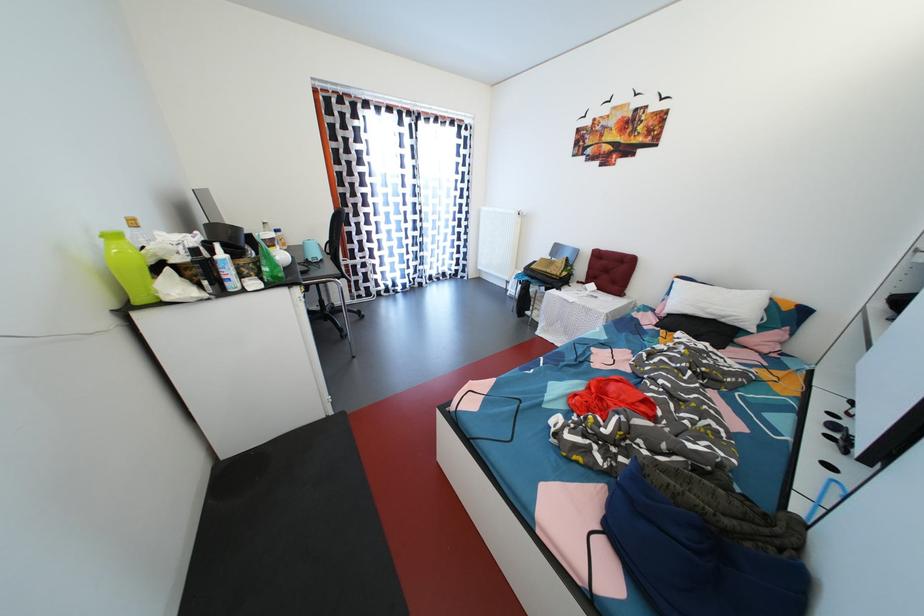
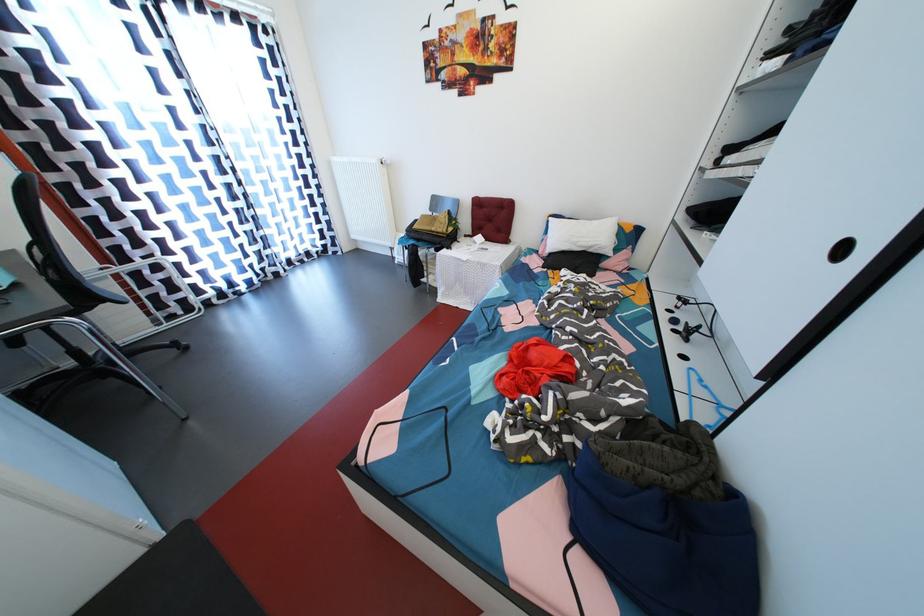
Question: The images are taken continuously from a first-person perspective. In which direction is your viewpoint rotating?

Choices:
 (A) Left
 (B) Right
 (C) Up
 (D) Down

Answer: (B)